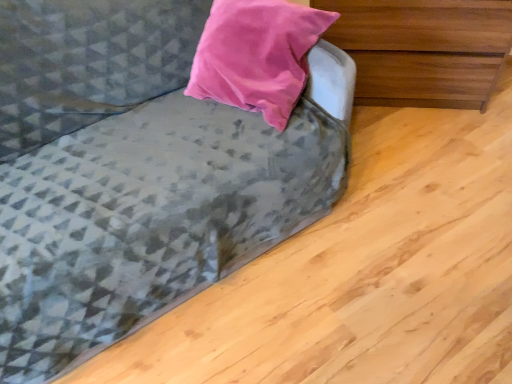
Question: Considering the positions of wooden chest of drawers at upper right and textured gray fabric couch at upper left in the image, is wooden chest of drawers at upper right wider or thinner than textured gray fabric couch at upper left?

Choices:
 (A) wide
 (B) thin

Answer: (B)

Question: Would you say wooden chest of drawers at upper right is to the left or to the right of textured gray fabric couch at upper left in the picture?

Choices:
 (A) left
 (B) right

Answer: (B)

Question: Is wooden chest of drawers at upper right inside or outside of textured gray fabric couch at upper left?

Choices:
 (A) inside
 (B) outside

Answer: (B)

Question: Is textured gray fabric couch at upper left in front of or behind wooden chest of drawers at upper right in the image?

Choices:
 (A) front
 (B) behind

Answer: (A)

Question: Choose the correct answer: Is textured gray fabric couch at upper left inside wooden chest of drawers at upper right or outside it?

Choices:
 (A) inside
 (B) outside

Answer: (B)

Question: Based on their sizes in the image, would you say textured gray fabric couch at upper left is bigger or smaller than wooden chest of drawers at upper right?

Choices:
 (A) big
 (B) small

Answer: (A)

Question: From the image's perspective, is textured gray fabric couch at upper left above or below wooden chest of drawers at upper right?

Choices:
 (A) above
 (B) below

Answer: (B)